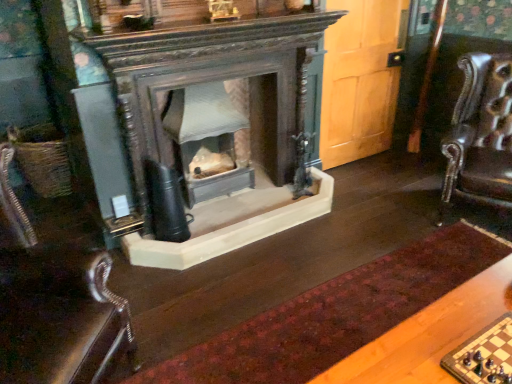
Identify the location of vacant space positioned to the left of leather swivel chair at right. The image size is (512, 384). (390, 216).